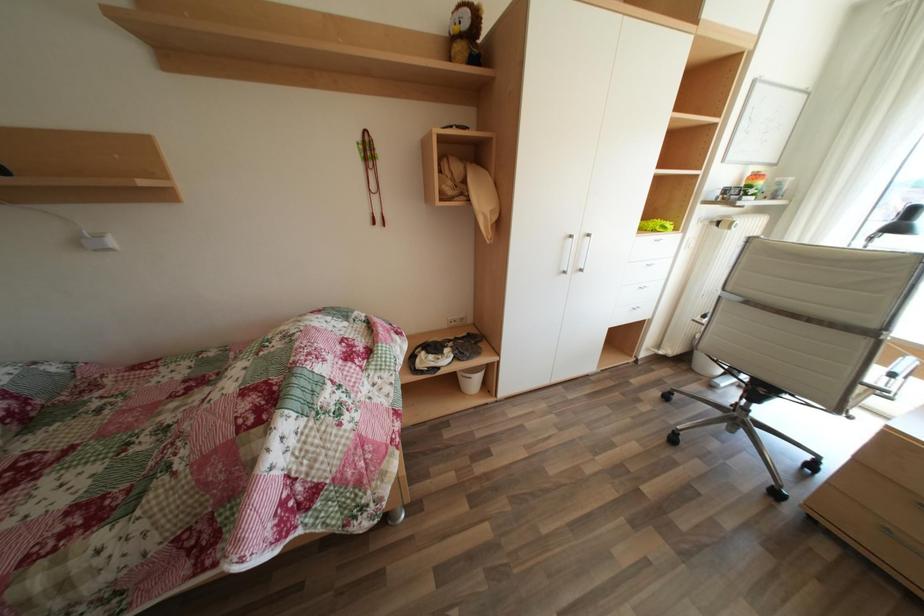
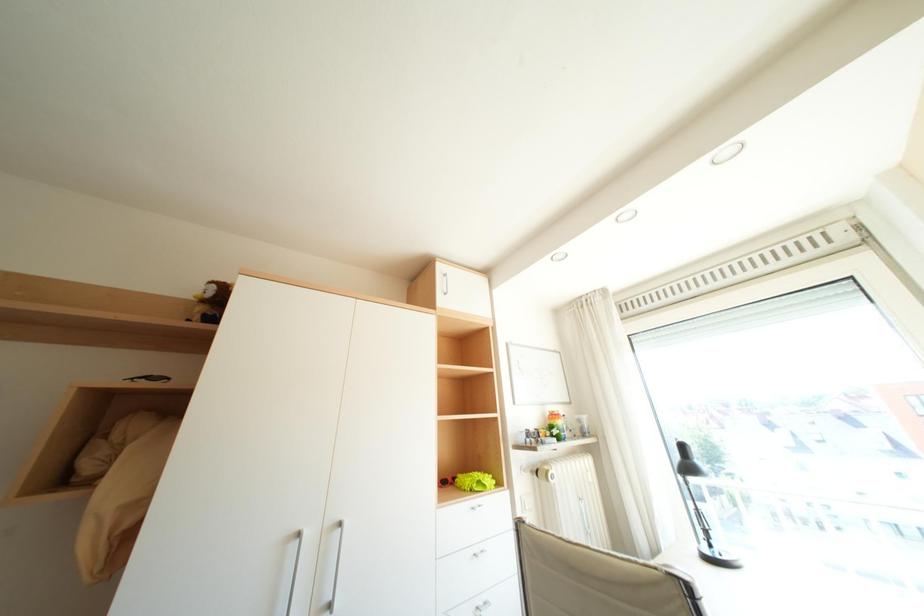
Based on the continuous images, in which direction is the camera rotating?

The camera's rotation is toward right-up.